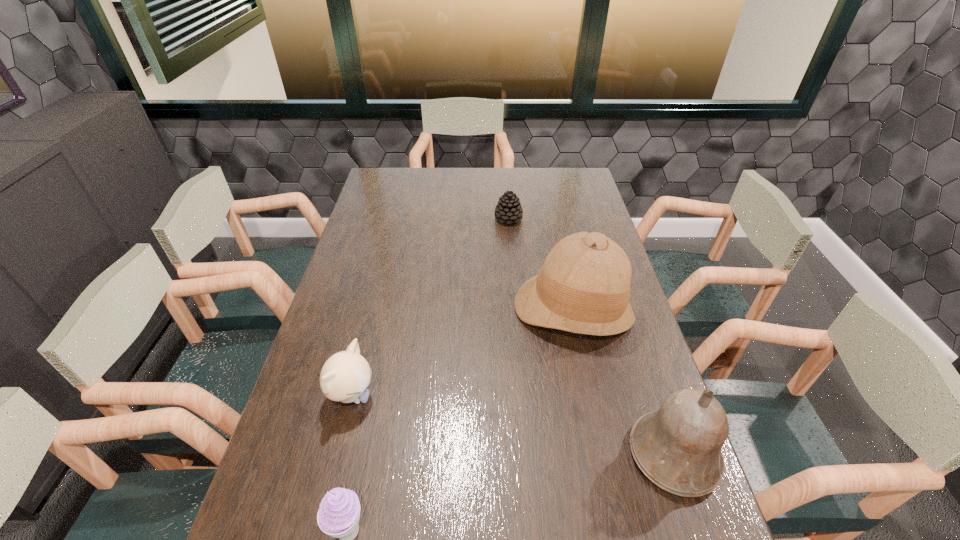
In order to click on object that is at the near right corner in this screenshot , I will do `click(678, 448)`.

Find the location of a particular element. The width and height of the screenshot is (960, 540). vacant space at the far edge of the desktop is located at coordinates (540, 195).

This screenshot has width=960, height=540. I want to click on free location at the near edge, so click(x=384, y=497).

Image resolution: width=960 pixels, height=540 pixels. In order to click on blank space at the left edge of the desktop in this screenshot , I will do `click(361, 233)`.

Where is `free space at the right edge of the desktop`? Image resolution: width=960 pixels, height=540 pixels. free space at the right edge of the desktop is located at coordinates (567, 197).

Locate an element on the screen. vacant space at the near right corner is located at coordinates (675, 505).

At what (x,y) coordinates should I click in order to perform the action: click on vacant region between the fourth shortest object and the kitten. Please return your answer as a coordinate pair (x, y). Looking at the image, I should click on (513, 424).

The height and width of the screenshot is (540, 960). What are the coordinates of `free space between the bell and the second farthest object` in the screenshot? It's located at (623, 382).

I want to click on empty location between the kitten and the pinecone, so click(430, 307).

Where is `unoccupied position between the tallest object and the fourth shortest object`? unoccupied position between the tallest object and the fourth shortest object is located at coordinates (623, 382).